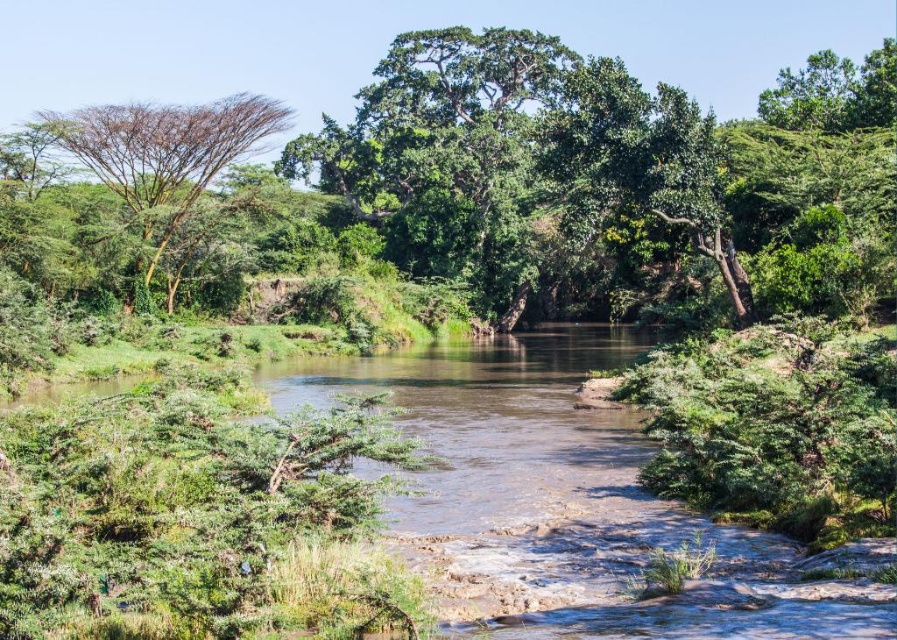
Is point (386, 170) positioned after point (164, 208)?

Yes, point (386, 170) is behind point (164, 208).

Is green leafy tree at center shorter than green leafy tree at left?

No.

The height and width of the screenshot is (640, 897). I want to click on green leafy tree at center, so click(x=527, y=170).